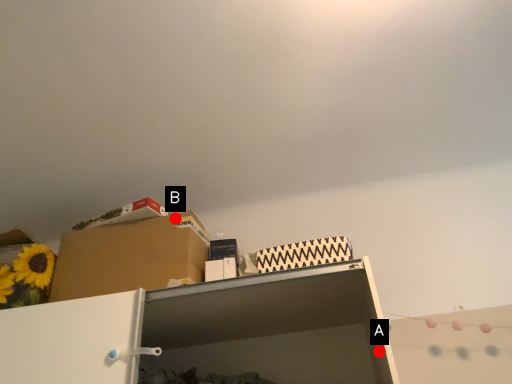
Question: Two points are circled on the image, labeled by A and B beside each circle. Which point is closer to the camera?

Choices:
 (A) A is closer
 (B) B is closer

Answer: (A)